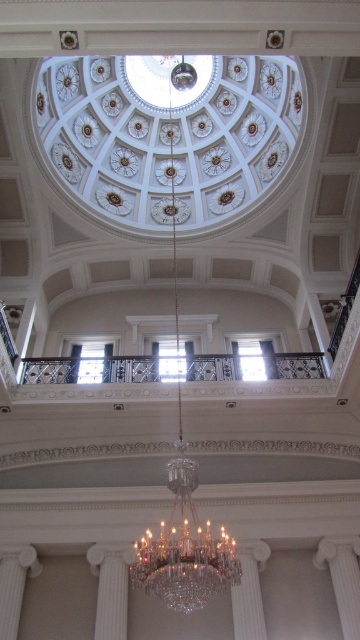
Is point (118, 596) more distant than point (16, 634)?

Yes, it is.

Which is in front, point (106, 636) or point (27, 556)?

Point (106, 636)

The image size is (360, 640). I want to click on white marble pillar at lower left, so click(110, 588).

Which is above, crystal at center or white glossy pillar at lower right?

crystal at center is above.

Which is more to the left, crystal at center or white glossy pillar at lower right?

Positioned to the left is crystal at center.

Who is more forward, (154, 547) or (347, 572)?

Point (154, 547) is in front.

Identify the location of crystal at center. The width and height of the screenshot is (360, 640). click(x=183, y=548).

Which is in front, point (172, 486) or point (10, 592)?

Point (172, 486) is in front.

Between crystal at center and white glossy pillar at lower left, which one is positioned lower?

white glossy pillar at lower left is below.

Measure the distance between crystal at center and camera.

crystal at center and camera are 36.49 meters apart.

The height and width of the screenshot is (640, 360). Find the location of `crystal at center`. crystal at center is located at coordinates (183, 548).